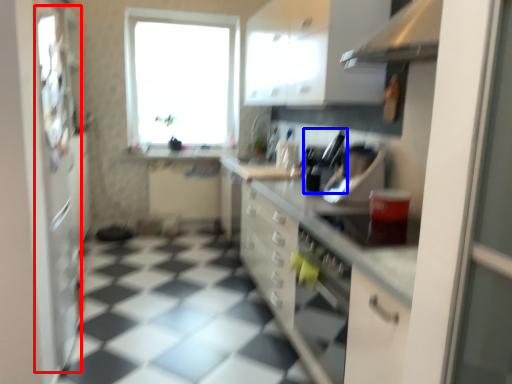
Question: Which point is further to the camera, screen door (highlighted by a red box) or appliance (highlighted by a blue box)?

Choices:
 (A) screen door
 (B) appliance

Answer: (B)